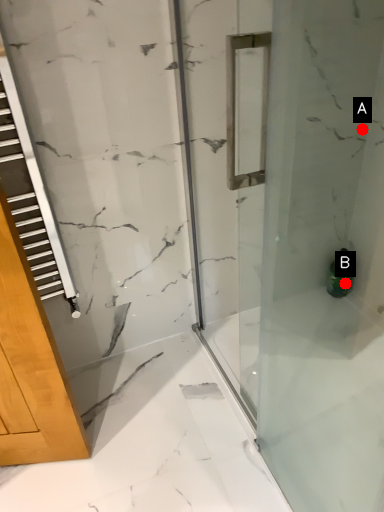
Question: Two points are circled on the image, labeled by A and B beside each circle. Which point is closer to the camera?

Choices:
 (A) A is closer
 (B) B is closer

Answer: (A)